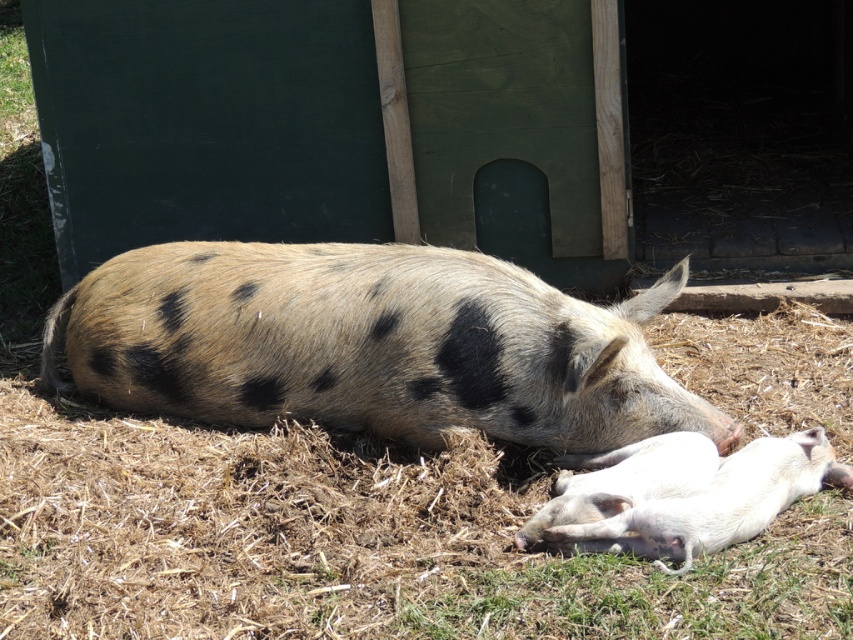
Question: Which of the following is the farthest from the observer?

Choices:
 (A) white smooth piglet at lower right
 (B) white smooth piglet at lower center
 (C) spotted fur pig at center

Answer: (C)

Question: Which of the following is the closest to the observer?

Choices:
 (A) spotted fur pig at center
 (B) white smooth piglet at lower center

Answer: (B)

Question: Is spotted fur pig at center closer to the viewer compared to white smooth piglet at lower center?

Choices:
 (A) no
 (B) yes

Answer: (A)

Question: Can you confirm if white smooth piglet at lower right is smaller than white smooth piglet at lower center?

Choices:
 (A) no
 (B) yes

Answer: (A)

Question: Observing the image, what is the correct spatial positioning of spotted fur pig at center in reference to white smooth piglet at lower right?

Choices:
 (A) above
 (B) below

Answer: (A)

Question: Which object is positioned closest to the spotted fur pig at center?

Choices:
 (A) white smooth piglet at lower center
 (B) white smooth piglet at lower right

Answer: (A)